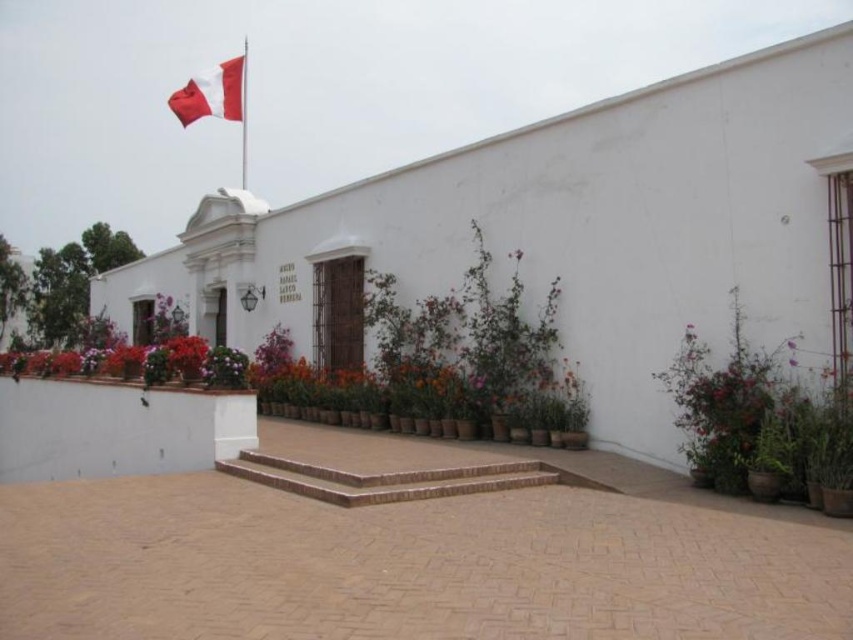
Question: Which point is closer to the camera?

Choices:
 (A) (705, 452)
 (B) (242, 88)

Answer: (A)

Question: Considering the relative positions of green leafy plant at right and red/white fabric flag at upper left in the image provided, where is green leafy plant at right located with respect to red/white fabric flag at upper left?

Choices:
 (A) above
 (B) below

Answer: (B)

Question: Which of the following is the closest to the observer?

Choices:
 (A) (751, 380)
 (B) (183, 112)

Answer: (A)

Question: In this image, where is red/white fabric flag at upper left located relative to metallic flag pole at upper left?

Choices:
 (A) below
 (B) above

Answer: (B)

Question: Is green leafy plant at right wider than metallic flag pole at upper left?

Choices:
 (A) yes
 (B) no

Answer: (B)

Question: Which of the following is the farthest from the observer?

Choices:
 (A) (236, 77)
 (B) (844, 397)

Answer: (A)